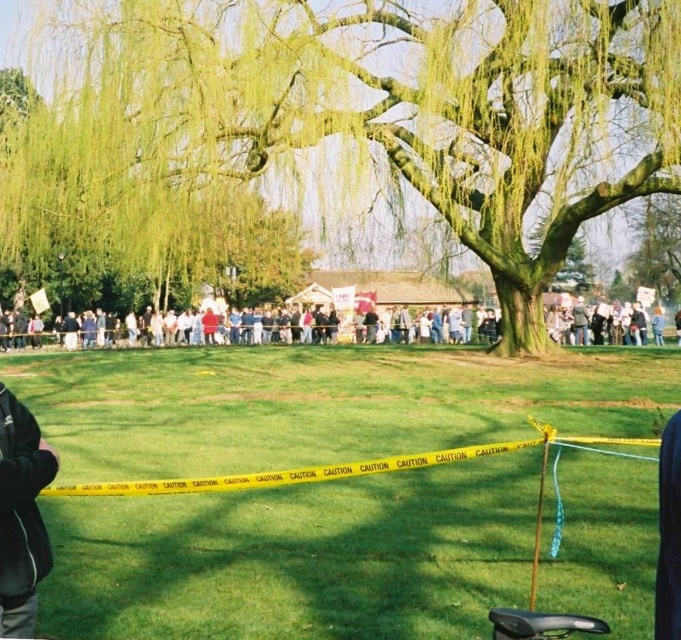
Is multicolored fabric crowd at center smaller than dark gray fleece jacket at left?

Incorrect, multicolored fabric crowd at center is not smaller in size than dark gray fleece jacket at left.

Is point (121, 328) in front of point (48, 556)?

No, (121, 328) is further to viewer.

Locate an element on the screen. This screenshot has width=681, height=640. multicolored fabric crowd at center is located at coordinates (240, 330).

Is point (417, 168) behind point (48, 564)?

Yes, it is.

Based on the photo, can you confirm if green leafy tree at center is positioned to the right of dark gray fleece jacket at left?

In fact, green leafy tree at center is to the left of dark gray fleece jacket at left.

Where is `green leafy tree at center`? green leafy tree at center is located at coordinates pos(340,125).

Consider the image. Is green leafy tree at upper center positioned behind dark gray fleece jacket at left?

That is True.

Can you confirm if green leafy tree at upper center is positioned below dark gray fleece jacket at left?

Incorrect, green leafy tree at upper center is not positioned below dark gray fleece jacket at left.

Is point (146, 212) closer to camera compared to point (16, 458)?

That is False.

At what (x,y) coordinates should I click in order to perform the action: click on green leafy tree at upper center. Please return your answer as a coordinate pair (x, y). This screenshot has width=681, height=640. Looking at the image, I should click on (129, 228).